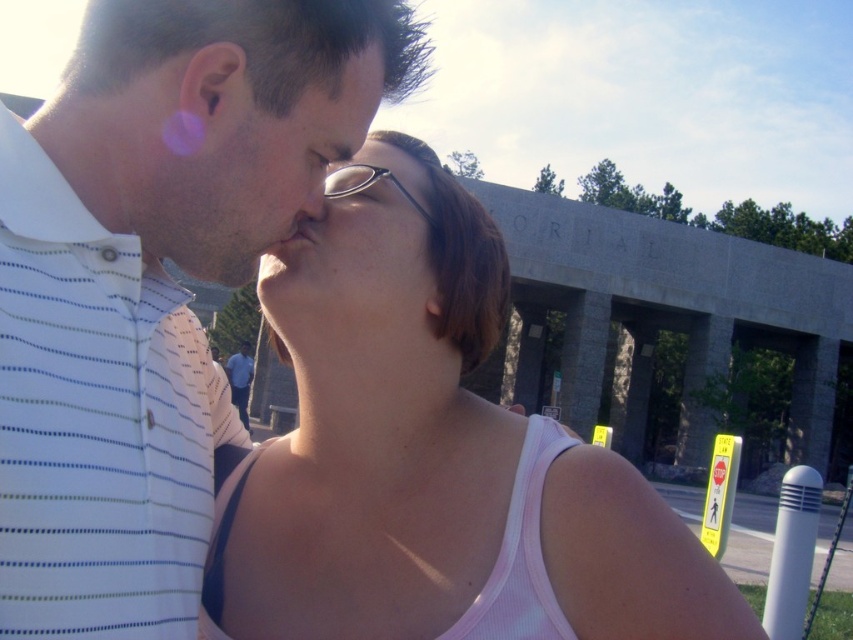
You are a photographer trying to capture a close shot of the two people kissing. You notice the pink fabric tank top at center and the matte black nose at center in your frame. Which object should you adjust your focus to ensure the wider one is in focus?

The pink fabric tank top at center is wider than the matte black nose at center, so you should focus on the pink fabric tank top at center to ensure the wider object is in focus.

You are a photographer trying to capture the blue striped shirt at center and the matte black nose at center in a single frame. Based on their positions, which object is closer to the camera?

The matte black nose at center is closer to the camera because it is positioned above the blue striped shirt at center, indicating it is in a more forward plane.

You are a photographer at the memorial site. You need to capture a close shot of the two individuals kissing. The pink fabric tank top at center and the blue striped shirt at center are both in the frame. Which clothing item will appear shorter in the photo?

The pink fabric tank top at center is shorter than the blue striped shirt at center, so it will appear shorter in the photo.